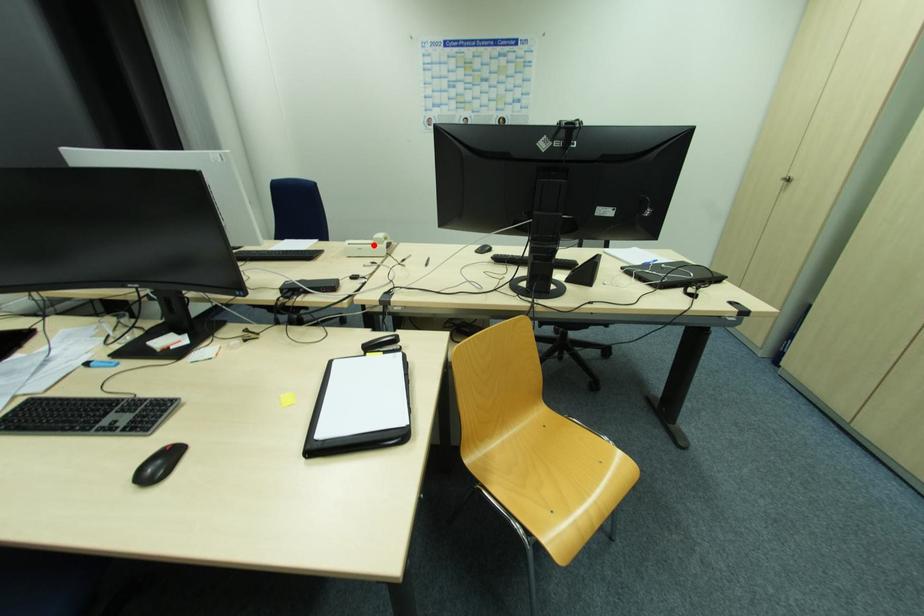
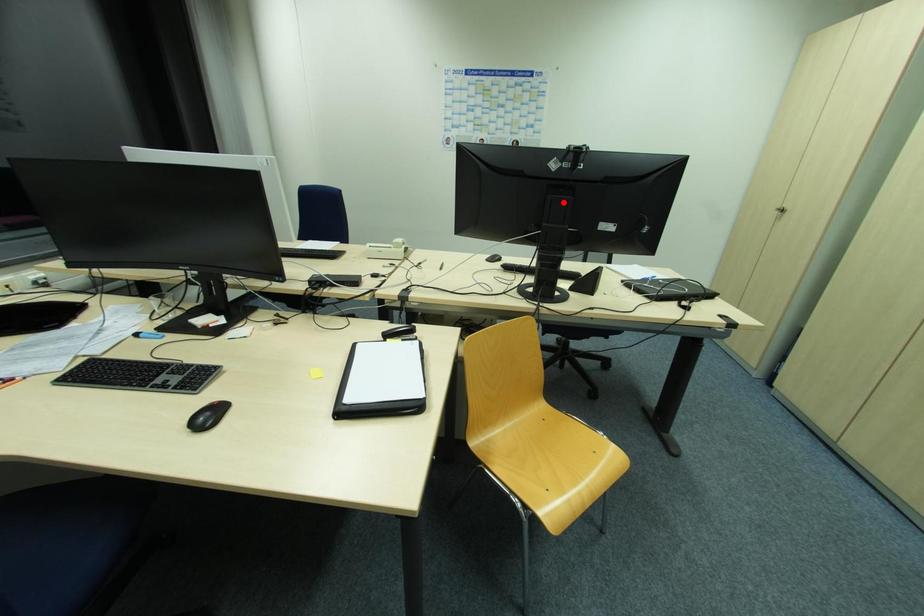
Consider the image. I am providing you with two images of the same scene from different viewpoints. A red point is marked on the first image and another point is marked on the second image. Is the red point in image1 aligned with the point shown in image2?

No